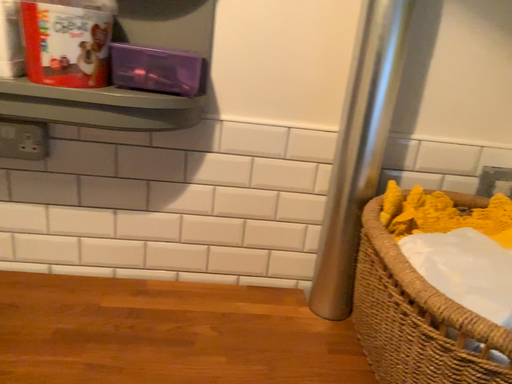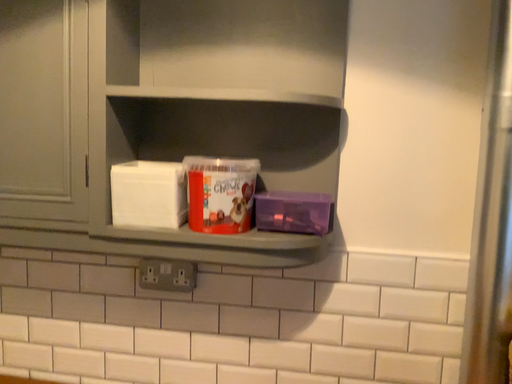
Question: Which way did the camera rotate in the video?

Choices:
 (A) rotated upward
 (B) rotated downward

Answer: (A)